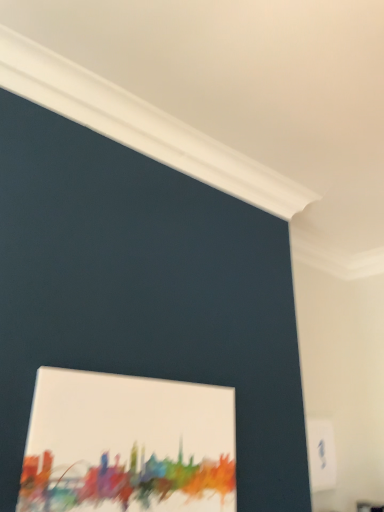
Find the location of a particular element. The image size is (384, 512). matte canvas painting at lower center is located at coordinates (128, 445).

This screenshot has width=384, height=512. What do you see at coordinates (128, 445) in the screenshot?
I see `matte canvas painting at lower center` at bounding box center [128, 445].

Identify the location of matte canvas painting at lower center. (128, 445).